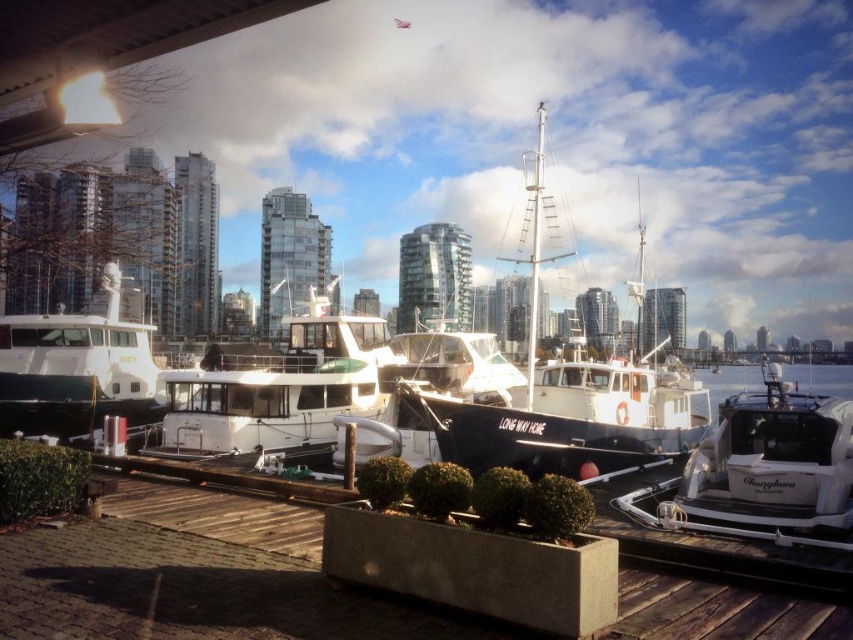
You are a photographer standing at the point marked by the coordinates (566, 397) in the image. You want to take a photo of the black matte sailboat at center. Is the sailboat within your immediate line of sight from that position?

The point marked by the coordinates (566, 397) marks the black matte sailboat at center, so yes, the sailboat is directly at your position and within your immediate line of sight.

You are a photographer planning to take a photo of the black matte sailboat at center and the white glossy water at center. Since you want both subjects to be clearly visible, which object should you prioritize focusing on, considering their sizes?

The black matte sailboat at center is larger in size than the white glossy water at center, so you should prioritize focusing on the black matte sailboat at center to ensure clarity.

You are standing on the wooden dock at center and want to board the black matte sailboat at center. Which direction should you move to get closer to the sailboat?

Since the wooden dock at center is closer to the viewer than the black matte sailboat at center, you should move forward along the wooden dock at center towards the water to approach the sailboat.